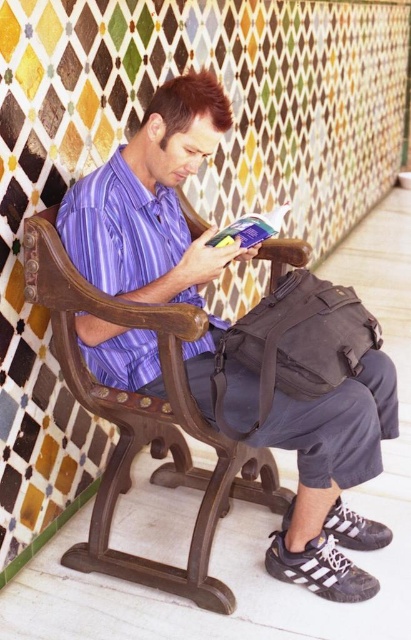
You are a tailor observing a man wearing two shirts. The purple striped shirt at center and the purple satin shirt at center. Which shirt is taller?

The purple striped shirt at center is much taller than the purple satin shirt at center.

You are a photographer trying to capture the man in the scene. You want to ensure that both the purple striped shirt at center and the hardcover book at center are clearly visible in your photo. Based on their positions, which object should you focus on to ensure both are in sharp focus?

Since the purple striped shirt at center is in front of the hardcover book at center, you should focus on the purple striped shirt at center to ensure both are in sharp focus.

You are a photographer trying to capture the man in the image. You need to focus your camera on the purple striped shirt at center and the hardcover book at center. Which object should you adjust your focus to first if you want to ensure both are in focus, considering their size in the frame?

The purple striped shirt at center is much taller than the hardcover book at center, so you should focus on the larger object first to ensure both are in focus.